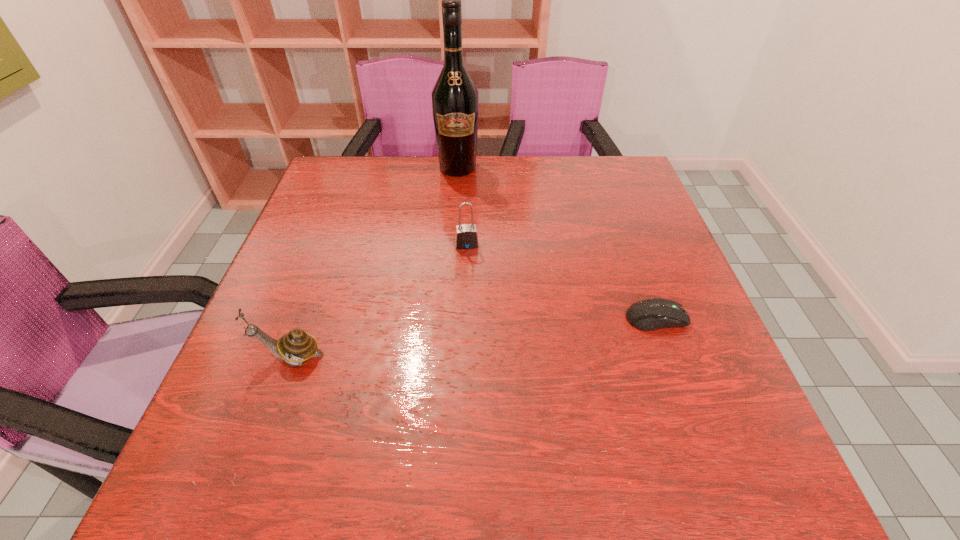
You are a GUI agent. You are given a task and a screenshot of the screen. Output one action in this format:
    pyautogui.click(x=<x>, y=<y>)
    Task: Click on the blank region between the farthest object and the padlock
    The height and width of the screenshot is (540, 960).
    Given the screenshot: What is the action you would take?
    pyautogui.click(x=463, y=206)

Identify the location of free area in between the computer equipment and the wine bottle. (557, 243).

At what (x,y) coordinates should I click in order to perform the action: click on vacant space that is in between the third farthest object and the second farthest object. Please return your answer as a coordinate pair (x, y). The width and height of the screenshot is (960, 540). Looking at the image, I should click on [x=562, y=281].

Where is `empty location between the leftmost object and the padlock`? The width and height of the screenshot is (960, 540). empty location between the leftmost object and the padlock is located at coordinates (378, 301).

Locate an element on the screen. object that ranks as the second closest to the padlock is located at coordinates (650, 314).

This screenshot has height=540, width=960. I want to click on object that is the third closest to the rightmost object, so click(297, 346).

This screenshot has height=540, width=960. What are the coordinates of `vacant point that satisfies the following two spatial constraints: 1. on the front side of the tallest object; 2. on the button of the shortest object` in the screenshot? It's located at (448, 318).

At what (x,y) coordinates should I click in order to perform the action: click on blank area in the image that satisfies the following two spatial constraints: 1. on the front side of the shortest object; 2. on the button of the wine bottle. Please return your answer as a coordinate pair (x, y). Image resolution: width=960 pixels, height=540 pixels. Looking at the image, I should click on (448, 318).

You are a GUI agent. You are given a task and a screenshot of the screen. Output one action in this format:
    pyautogui.click(x=<x>, y=<y>)
    Task: Click on the free space that satisfies the following two spatial constraints: 1. on the front side of the tallest object; 2. on the right side of the second farthest object
    The width and height of the screenshot is (960, 540).
    Given the screenshot: What is the action you would take?
    pyautogui.click(x=453, y=245)

I want to click on vacant space that satisfies the following two spatial constraints: 1. on the front side of the shortest object; 2. on the button of the padlock, so click(x=465, y=318).